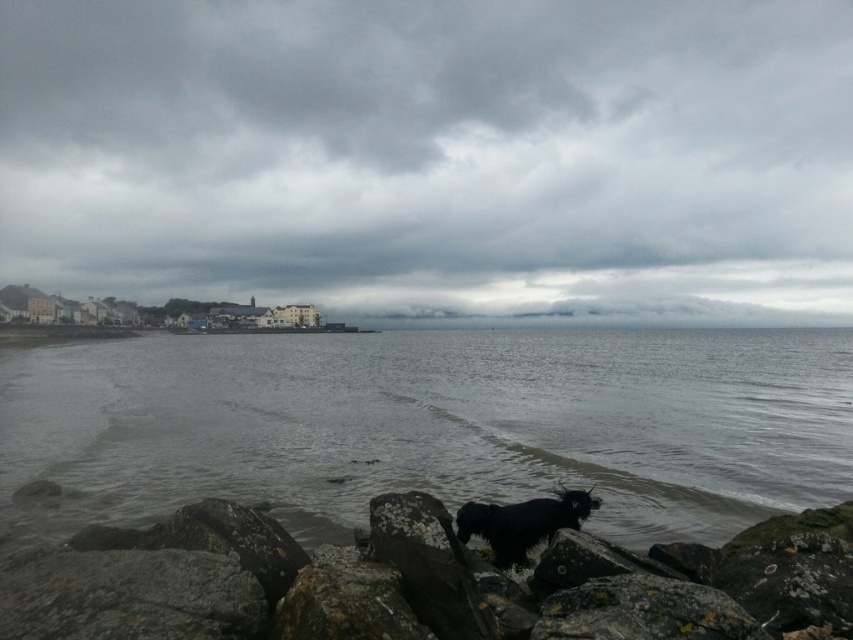
You are standing on the rocky shoreline in the coastal scene. You notice a point marked at coordinates (433, 154). What does this point indicate?

The point at coordinates (433, 154) indicates the cloudy sky at upper center.

You are standing on the rocky shoreline and want to cross to the other side. The gray matte water at center and the rough textured rock at lower center are in your path. Which one should you avoid stepping on to prevent slipping?

You should avoid stepping on the rough textured rock at lower center because it has a rough texture, making it more slippery when wet compared to the smooth gray matte water at center.

You are a photographer standing at the shoreline with the black dog. You want to capture a photo where the gray matte water at center is clearly visible in the background. Given the distance between the two, will the water be in focus if you focus on the shiny black fur at center?

The gray matte water at center is 50.54 meters away from the shiny black fur at center. If you focus on the shiny black fur at center, the depth of field may not extend far enough to keep the gray matte water at center in focus at that distance, especially in low light conditions typical of an overcast sky. Consider using a smaller aperture or adjusting your focus point to ensure both are sharp.